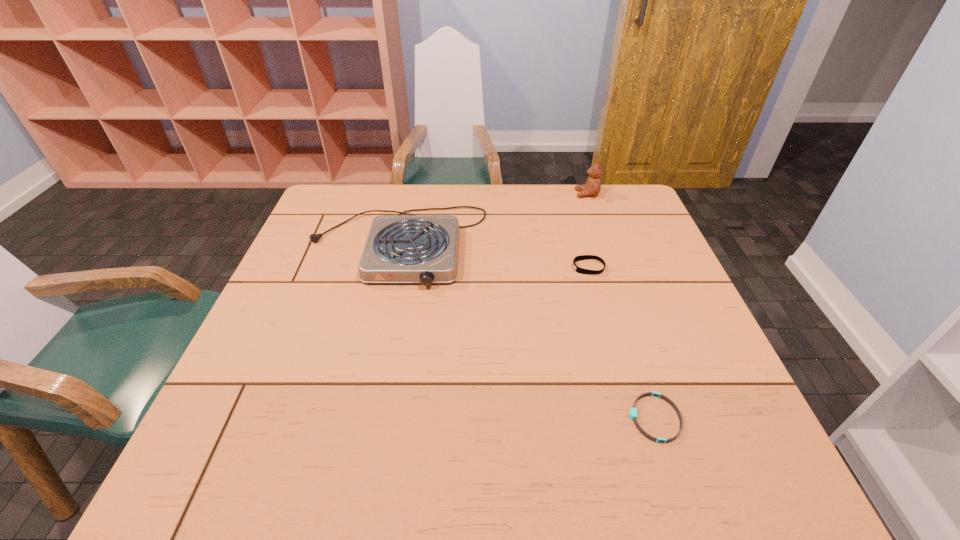
Image resolution: width=960 pixels, height=540 pixels. Identify the location of object located at the near edge. (633, 415).

The image size is (960, 540). Identify the location of object located in the left edge section of the desktop. (408, 248).

Find the location of a particular element. teddy bear that is at the right edge is located at coordinates (592, 187).

Where is `wristband present at the right edge`? Image resolution: width=960 pixels, height=540 pixels. wristband present at the right edge is located at coordinates (633, 415).

Find the location of a particular element. object present at the far left corner is located at coordinates (408, 248).

Identify the location of object situated at the far right corner. This screenshot has width=960, height=540. (592, 187).

Identify the location of object at the near right corner. (633, 415).

Locate an element on the screen. The image size is (960, 540). free space at the far edge is located at coordinates (388, 195).

Find the location of a particular element. This screenshot has height=540, width=960. blank area at the near edge is located at coordinates (465, 463).

The height and width of the screenshot is (540, 960). Find the location of `free region at the left edge of the desktop`. free region at the left edge of the desktop is located at coordinates (320, 332).